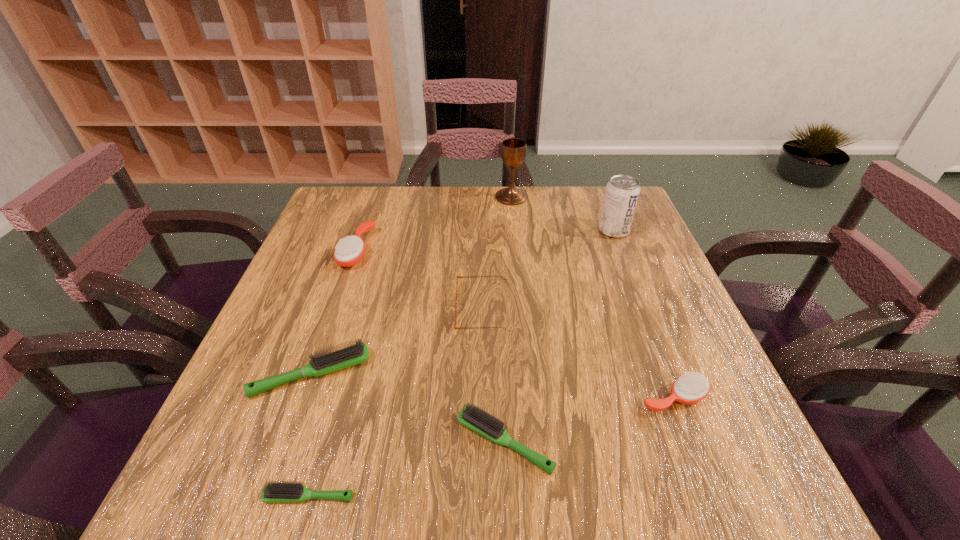
Identify the location of the nearest light hairbrush. (278, 491).

The width and height of the screenshot is (960, 540). Identify the location of the nearest hairbrush. (278, 491).

This screenshot has width=960, height=540. I want to click on free space located on the left of the farthest object, so click(456, 197).

Image resolution: width=960 pixels, height=540 pixels. What are the coordinates of `vacant space located on the left of the second tallest object` in the screenshot? It's located at (557, 231).

Find the location of a particular element. The width and height of the screenshot is (960, 540). vacant region located 0.250m on the front of the tallest hairbrush is located at coordinates 321,353.

Image resolution: width=960 pixels, height=540 pixels. In order to click on free space located 0.260m on the face of the sunglasses in this screenshot , I will do `click(339, 309)`.

Identify the location of free spot located on the face of the sunglasses. The height and width of the screenshot is (540, 960). (330, 309).

I want to click on free space located on the face of the sunglasses, so click(x=402, y=309).

The image size is (960, 540). What are the coordinates of `blank space located 0.270m on the right of the biggest light hairbrush` in the screenshot? It's located at (508, 374).

You are a GUI agent. You are given a task and a screenshot of the screen. Output one action in this format:
    pyautogui.click(x=<x>, y=<y>)
    Task: Click on the vacant space located on the front of the smaller orange hairbrush
    
    Given the screenshot: What is the action you would take?
    pyautogui.click(x=703, y=472)